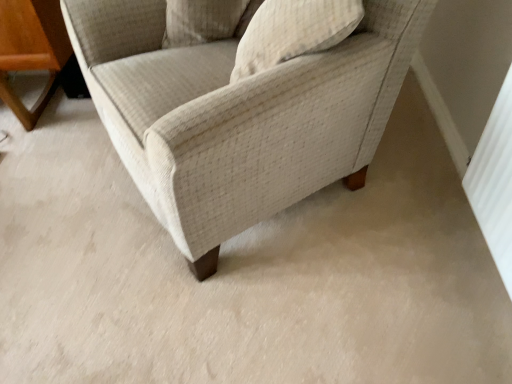
Question: Does beige fabric chair at center turn towards textured beige pillow at upper center, which appears as the 2th pillow when viewed from the left?

Choices:
 (A) no
 (B) yes

Answer: (B)

Question: Is beige fabric chair at center oriented away from textured beige pillow at upper center, which appears as the 2th pillow when viewed from the left?

Choices:
 (A) yes
 (B) no

Answer: (A)

Question: Considering the relative sizes of beige fabric chair at center and textured beige pillow at upper center, the 1th pillow positioned from the right, in the image provided, is beige fabric chair at center bigger than textured beige pillow at upper center, the 1th pillow positioned from the right,?

Choices:
 (A) no
 (B) yes

Answer: (B)

Question: From the image's perspective, does beige fabric chair at center appear lower than textured beige pillow at upper center, which appears as the 2th pillow when viewed from the left?

Choices:
 (A) no
 (B) yes

Answer: (B)

Question: Are beige fabric chair at center and textured beige pillow at upper center, which appears as the 2th pillow when viewed from the left, located far from each other?

Choices:
 (A) yes
 (B) no

Answer: (B)

Question: Based on their positions, is beige fabric chair at center located to the left or right of beige textured pillow at upper center, acting as the second pillow starting from the right?

Choices:
 (A) right
 (B) left

Answer: (A)

Question: Considering the positions of beige fabric chair at center and beige textured pillow at upper center, acting as the second pillow starting from the right, in the image, is beige fabric chair at center taller or shorter than beige textured pillow at upper center, acting as the second pillow starting from the right,?

Choices:
 (A) tall
 (B) short

Answer: (A)

Question: Based on their sizes in the image, would you say beige fabric chair at center is bigger or smaller than beige textured pillow at upper center, acting as the second pillow starting from the right?

Choices:
 (A) small
 (B) big

Answer: (B)

Question: Relative to beige textured pillow at upper center, acting as the second pillow starting from the right, is beige fabric chair at center in front or behind?

Choices:
 (A) front
 (B) behind

Answer: (A)

Question: Considering their positions, is textured beige pillow at upper center, which appears as the 2th pillow when viewed from the left, located in front of or behind beige textured pillow at upper center, the first pillow viewed from the left?

Choices:
 (A) behind
 (B) front

Answer: (B)

Question: Is textured beige pillow at upper center, the 1th pillow positioned from the right, wider or thinner than beige textured pillow at upper center, the first pillow viewed from the left?

Choices:
 (A) thin
 (B) wide

Answer: (B)

Question: Is textured beige pillow at upper center, which appears as the 2th pillow when viewed from the left, to the left or to the right of beige textured pillow at upper center, acting as the second pillow starting from the right, in the image?

Choices:
 (A) left
 (B) right

Answer: (B)

Question: Is point pos(245,38) closer or farther from the camera than point pos(208,23)?

Choices:
 (A) closer
 (B) farther

Answer: (A)

Question: Is point (246, 56) positioned closer to the camera than point (367, 134)?

Choices:
 (A) closer
 (B) farther

Answer: (A)

Question: From the image's perspective, relative to beige fabric chair at center, is textured beige pillow at upper center, which appears as the 2th pillow when viewed from the left, above or below?

Choices:
 (A) below
 (B) above

Answer: (B)